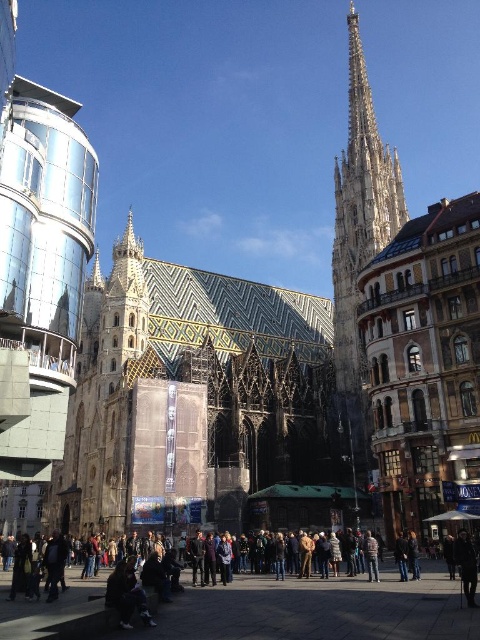
Question: Where is dark brown leather jacket at lower center located in relation to light brown stone tower at center right in the image?

Choices:
 (A) above
 (B) below

Answer: (B)

Question: Which point is farther to the camera?

Choices:
 (A) (352, 198)
 (B) (324, 596)

Answer: (A)

Question: Is dark brown leather jacket at lower center wider than light brown stone tower at center right?

Choices:
 (A) no
 (B) yes

Answer: (B)

Question: Is dark brown leather jacket at lower center to the left of light brown stone tower at center right from the viewer's perspective?

Choices:
 (A) yes
 (B) no

Answer: (A)

Question: Which object is farther from the camera taking this photo?

Choices:
 (A) light brown stone tower at center right
 (B) dark brown leather jacket at lower center

Answer: (A)